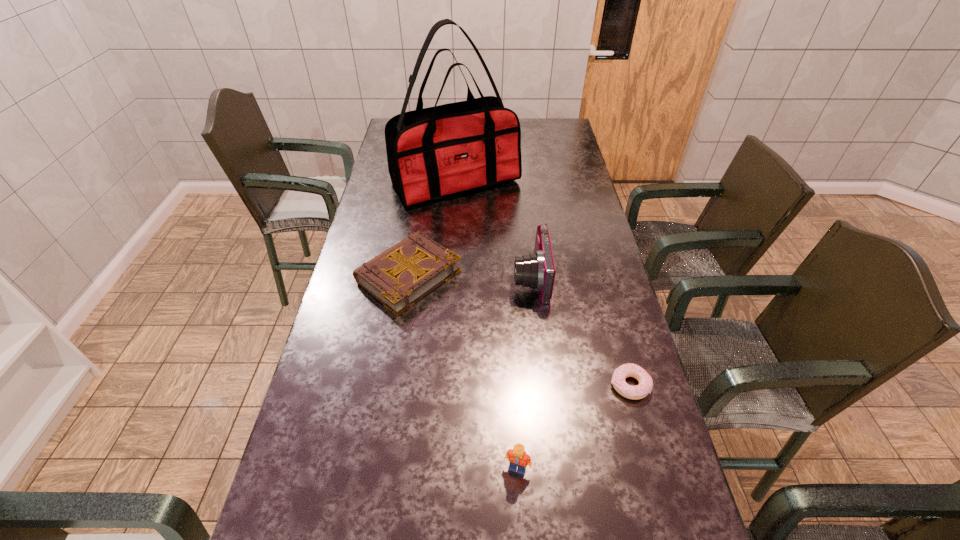
Identify the location of free space between the camera and the third tallest object. (523, 373).

The height and width of the screenshot is (540, 960). In order to click on vacant space that is in between the fourth shortest object and the hardback book in this screenshot , I will do `click(469, 278)`.

This screenshot has height=540, width=960. In order to click on vacant area between the shortest object and the fourth shortest object in this screenshot , I will do `click(580, 332)`.

Image resolution: width=960 pixels, height=540 pixels. I want to click on empty space that is in between the third tallest object and the camera, so click(523, 373).

Find the location of a particular element. The width and height of the screenshot is (960, 540). vacant point located between the tallest object and the nearest object is located at coordinates (486, 325).

Identify the location of empty space that is in between the camera and the hardback book. (469, 278).

Find the location of a particular element. The width and height of the screenshot is (960, 540). unoccupied position between the third tallest object and the fourth farthest object is located at coordinates (573, 427).

Where is `vacant area between the second nearest object and the nearest object`? The width and height of the screenshot is (960, 540). vacant area between the second nearest object and the nearest object is located at coordinates (573, 427).

Select which object is the second closest to the third shortest object. Please provide its 2D coordinates. Your answer should be formatted as a tuple, i.e. [(x, y)], where the tuple contains the x and y coordinates of a point satisfying the conditions above.

[(399, 277)]

Identify which object is located as the third nearest to the tallest object. Please provide its 2D coordinates. Your answer should be formatted as a tuple, i.e. [(x, y)], where the tuple contains the x and y coordinates of a point satisfying the conditions above.

[(644, 388)]